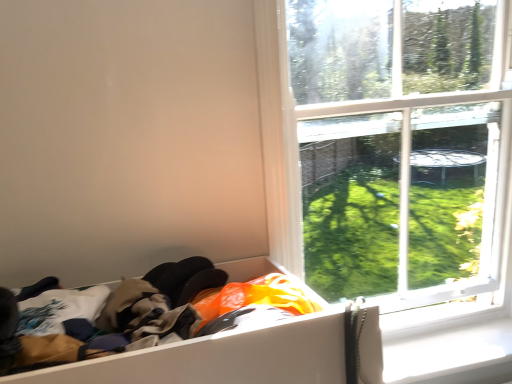
Image resolution: width=512 pixels, height=384 pixels. Find the location of `blank space above white plastic window sill at lower right (from a real-world perspective)`. blank space above white plastic window sill at lower right (from a real-world perspective) is located at coordinates (438, 349).